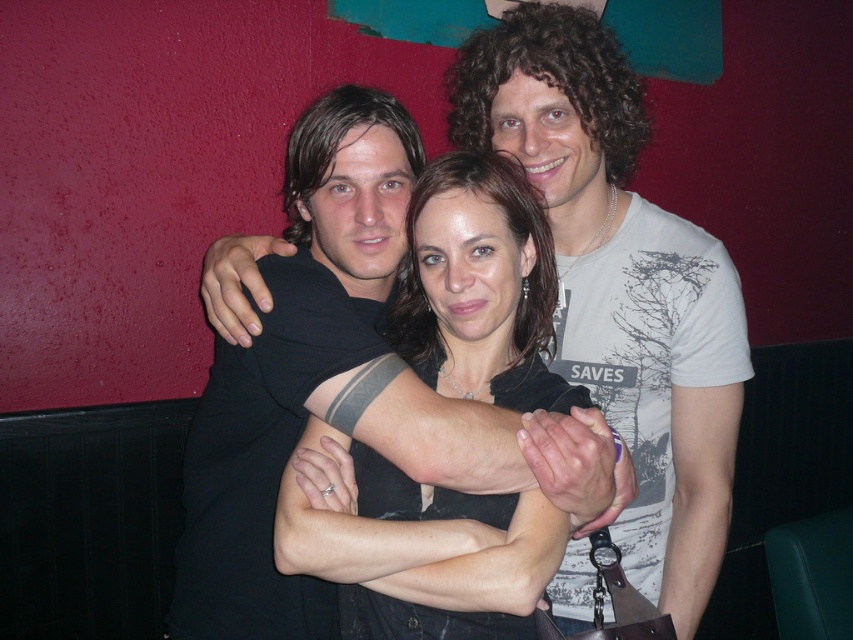
Find the location of `black matte shirt at center`. black matte shirt at center is located at coordinates (621, 284).

Who is positioned more to the right, black matte shirt at center or matte black shirt at center?

Positioned to the right is black matte shirt at center.

Is point (602, 97) positioned in front of point (476, 208)?

No, (602, 97) is behind (476, 208).

Image resolution: width=853 pixels, height=640 pixels. I want to click on black matte shirt at center, so click(x=621, y=284).